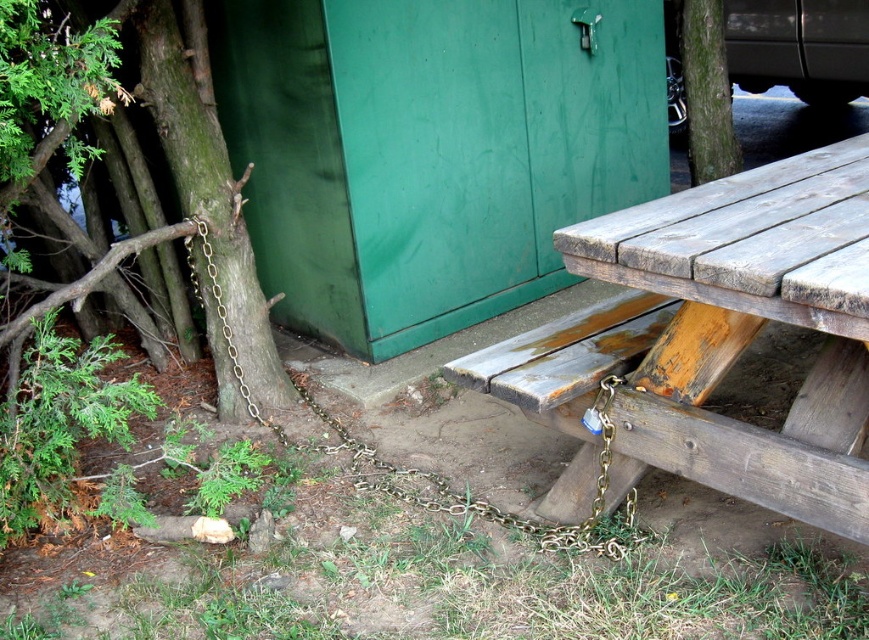
You are standing at the center of the image. Which direction should you move to reach the green rough bark tree at left?

You should move to the left to reach the green rough bark tree at left since it is located at the left side of the image.

You are standing at the picnic table and want to walk towards the green shed doors. Which direction should you walk relative to the point at coordinates point (706,92)?

The point (706,92) corresponds to the green rough bark tree at upper right. Since the shed is in the background and the tree is at the upper right, walking away from the point (706,92) would lead you towards the shed doors.

You are a park visitor who wants to reach the picnic table but notices the gold chain at lower left is locked. To determine if you can approach the picnic table from the direction of the green rough bark tree at upper right, which object is higher in the image?

The green rough bark tree at upper right is located above the gold chain at lower left, so you can approach the picnic table from the direction of the green rough bark tree at upper right because it is higher up in the image.